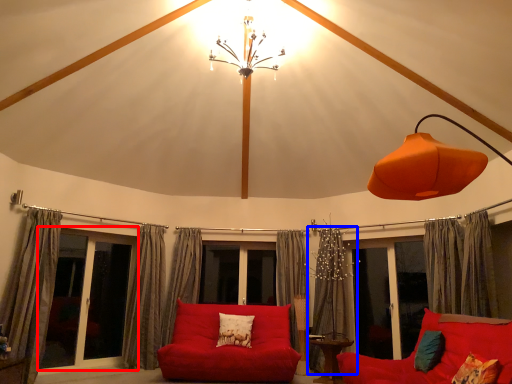
Question: Which of the following is the farthest to the observer, bay window (highlighted by a red box) or curtain (highlighted by a blue box)?

Choices:
 (A) bay window
 (B) curtain

Answer: (B)